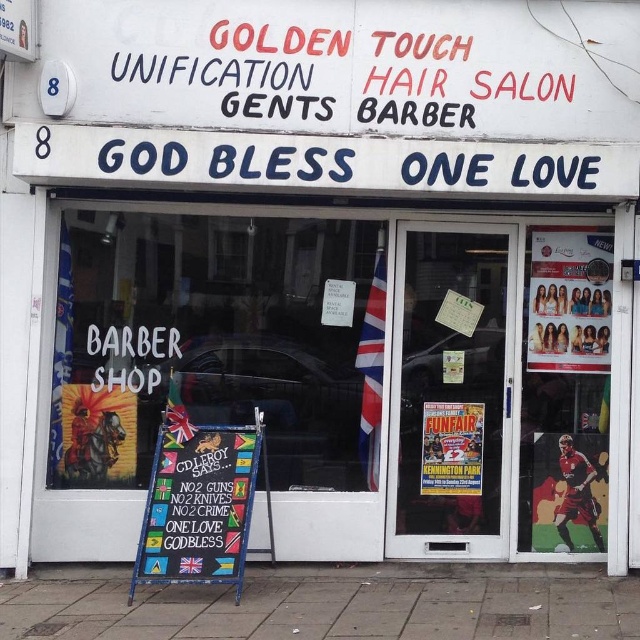
You are standing outside the barbershop looking at the transparent glass barber shop sign at center and the paper poster at center. Which object is nearer to you?

The transparent glass barber shop sign at center is closer to the viewer than the paper poster at center.

You are a delivery person trying to deliver a package to the barbershop. The package is too large to fit through the transparent glass door at center. Can you slide it through the space next to the paper poster at center instead?

The transparent glass door at center is wider than the paper poster at center, so the space next to the paper poster at center is narrower. The package may not fit through that space.